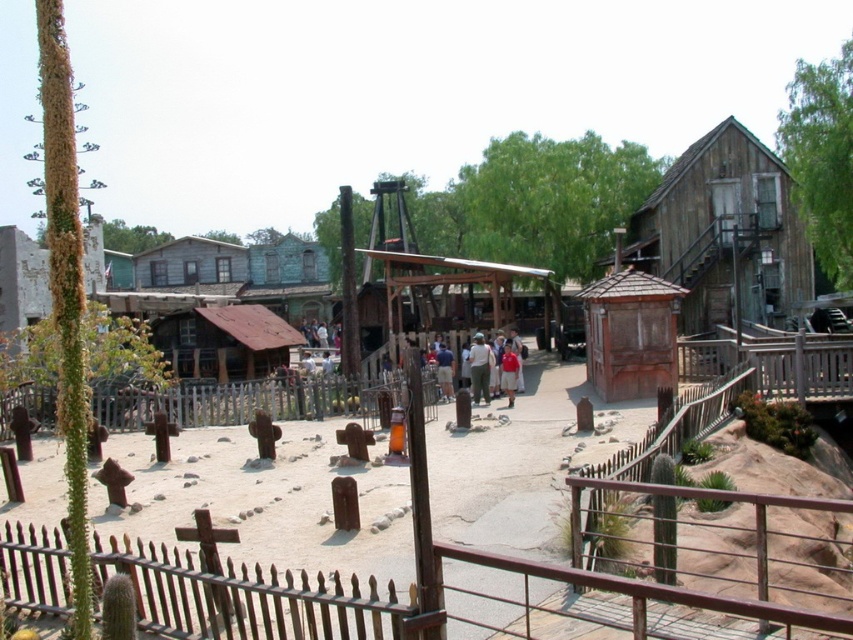
You are standing at point [242,401] in the Western town scene. What object is exactly at your current location?

The wooden picket fence at center is exactly at point [242,401].

From the picture: You are standing at the entrance of the Western town scene and want to walk towards the brown wooden fence at lower center. According to the coordinates provided, in which direction should you move relative to your current position?

The brown wooden fence at lower center is located at coordinates point (404,604). Since the x and y coordinates are both above 0.5, you should move towards the lower right direction from your current position to reach it.

You are standing at the wooden picket fence at center. You want to take a photo of the camera that is 61.23 feet away. Is the camera visible from your current position?

The wooden picket fence at center and camera are 61.23 feet apart from each other. Since there is no mention of obstructions between them, the camera should be visible from the wooden picket fence at center.